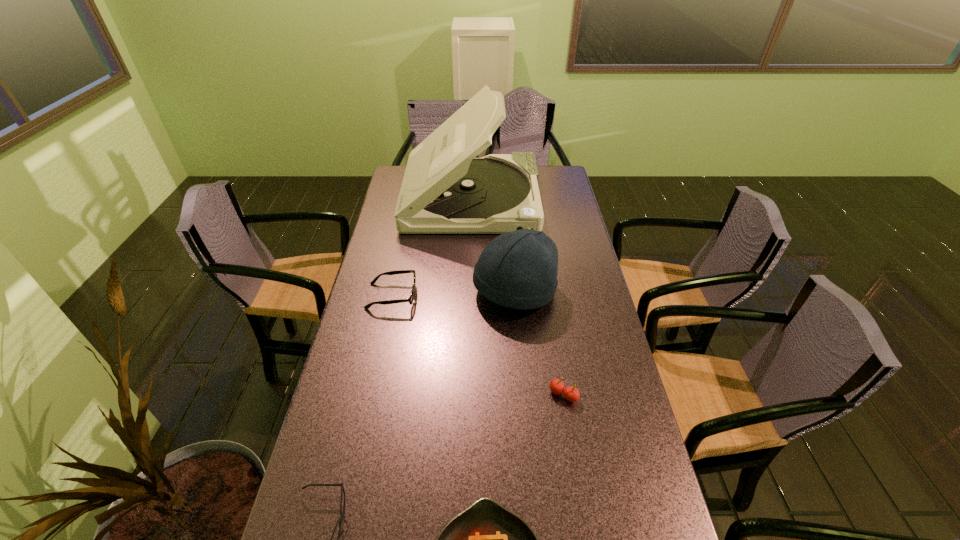
Locate an element on the screen. CD player is located at coordinates (445, 190).

This screenshot has width=960, height=540. What are the coordinates of `the farthest object` in the screenshot? It's located at (445, 190).

Image resolution: width=960 pixels, height=540 pixels. What are the coordinates of `skullcap` in the screenshot? It's located at (518, 269).

I want to click on the third tallest object, so click(570, 393).

Image resolution: width=960 pixels, height=540 pixels. In order to click on the fourth farthest object in this screenshot , I will do `click(570, 393)`.

Where is `the fourth tallest object`? The height and width of the screenshot is (540, 960). the fourth tallest object is located at coordinates (410, 299).

Where is `the farther spectacles`? the farther spectacles is located at coordinates (410, 299).

At what (x,y) coordinates should I click in order to perform the action: click on free region located 0.060m on the control panel of the farthest object. Please return your answer as a coordinate pair (x, y). Looking at the image, I should click on tap(553, 198).

At what (x,y) coordinates should I click in order to perform the action: click on free space located on the left of the skullcap. Please return your answer as a coordinate pair (x, y). Looking at the image, I should click on (423, 291).

The image size is (960, 540). In order to click on free region located on the left of the third tallest object in this screenshot , I will do `click(432, 395)`.